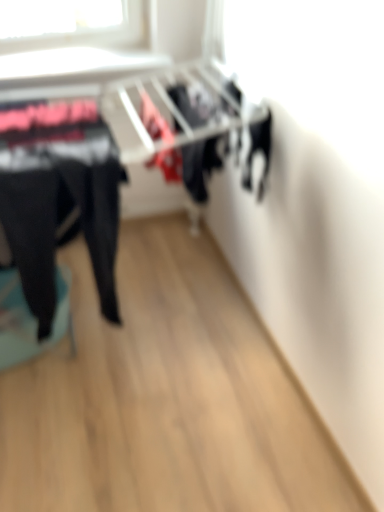
Question: From a real-world perspective, does matte black stool at left stand above black fabric pants at left?

Choices:
 (A) no
 (B) yes

Answer: (A)

Question: Is matte black stool at left bigger than black fabric pants at left?

Choices:
 (A) yes
 (B) no

Answer: (B)

Question: Is matte black stool at left behind black fabric pants at left?

Choices:
 (A) yes
 (B) no

Answer: (A)

Question: Can you confirm if matte black stool at left is smaller than black fabric pants at left?

Choices:
 (A) no
 (B) yes

Answer: (B)

Question: Considering the relative positions of matte black stool at left and black fabric pants at left in the image provided, is matte black stool at left to the right of black fabric pants at left from the viewer's perspective?

Choices:
 (A) no
 (B) yes

Answer: (A)

Question: Can you confirm if matte black stool at left is positioned to the left of black fabric pants at left?

Choices:
 (A) no
 (B) yes

Answer: (B)

Question: Is black fabric pants at left outside matte black stool at left?

Choices:
 (A) yes
 (B) no

Answer: (A)

Question: Is black fabric pants at left positioned with its back to matte black stool at left?

Choices:
 (A) yes
 (B) no

Answer: (B)

Question: Considering the relative positions of black fabric pants at left and matte black stool at left in the image provided, is black fabric pants at left to the left of matte black stool at left from the viewer's perspective?

Choices:
 (A) no
 (B) yes

Answer: (A)

Question: Is the surface of black fabric pants at left in direct contact with matte black stool at left?

Choices:
 (A) yes
 (B) no

Answer: (B)

Question: Are black fabric pants at left and matte black stool at left far apart?

Choices:
 (A) no
 (B) yes

Answer: (A)

Question: Is matte black stool at left a part of black fabric pants at left?

Choices:
 (A) no
 (B) yes

Answer: (A)

Question: Relative to matte black stool at left, is black fabric pants at left in front or behind?

Choices:
 (A) front
 (B) behind

Answer: (A)